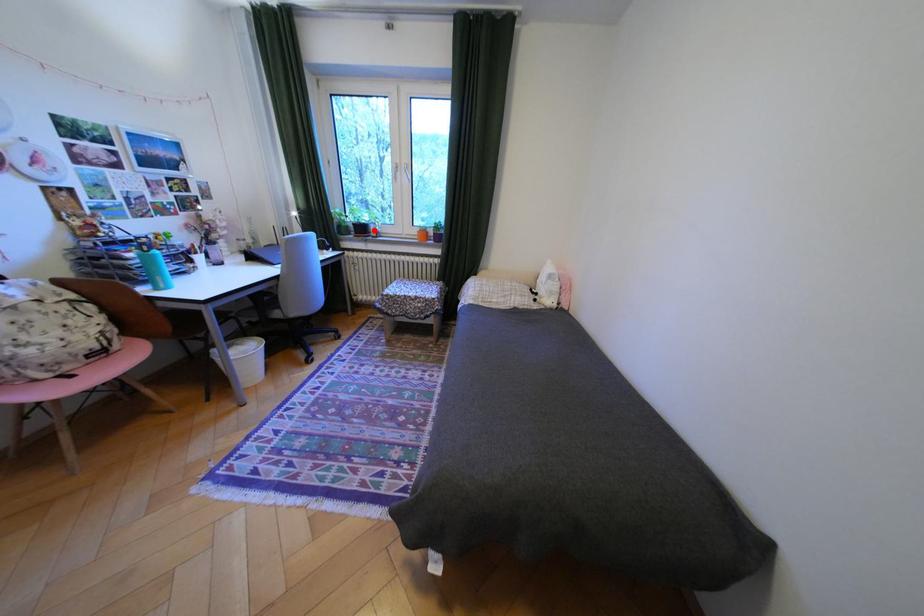
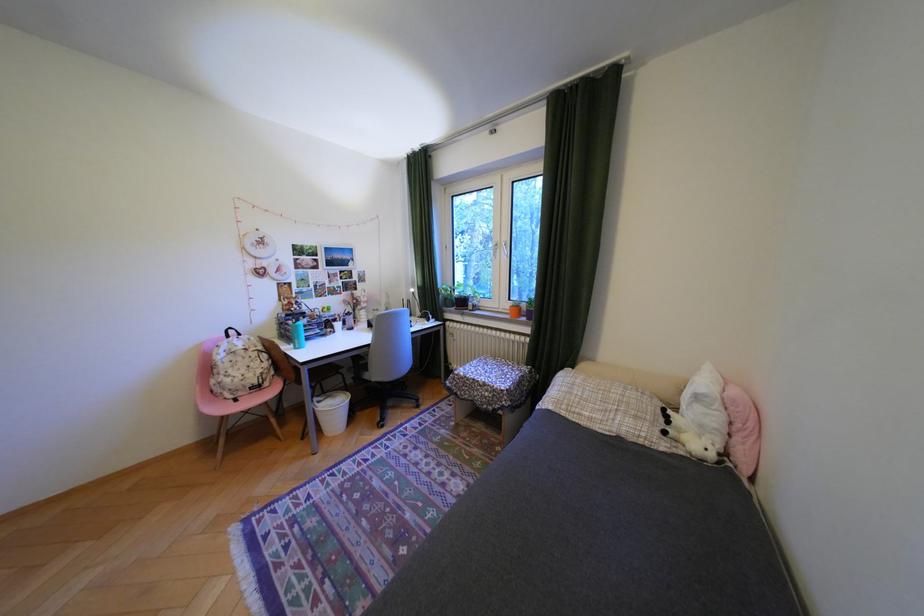
Where in the second image is the point corresponding to the highlighted location from the first image?

(475, 302)